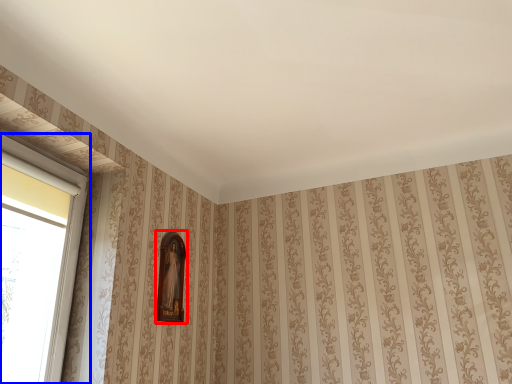
Question: Which object appears closest to the camera in this image, picture frame (highlighted by a red box) or window (highlighted by a blue box)?

Choices:
 (A) picture frame
 (B) window

Answer: (B)